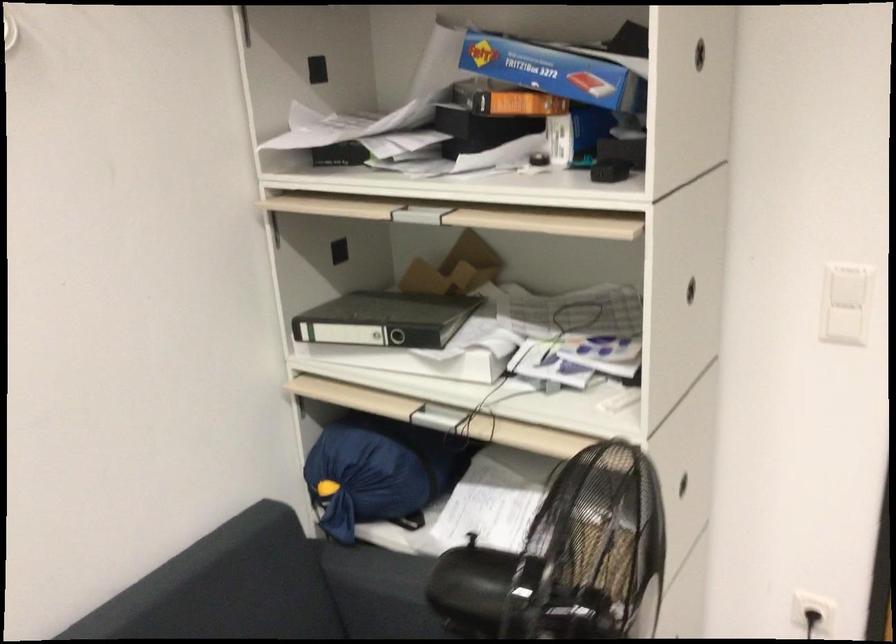
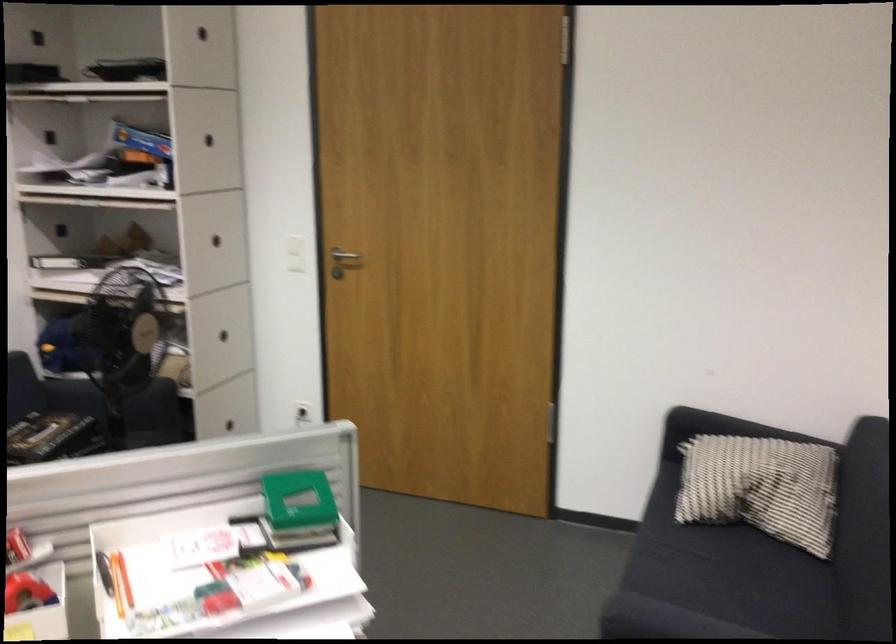
Question: The images are taken continuously from a first-person perspective. In which direction are you moving?

Choices:
 (A) Left
 (B) Right
 (C) Forward
 (D) Backward

Answer: (D)